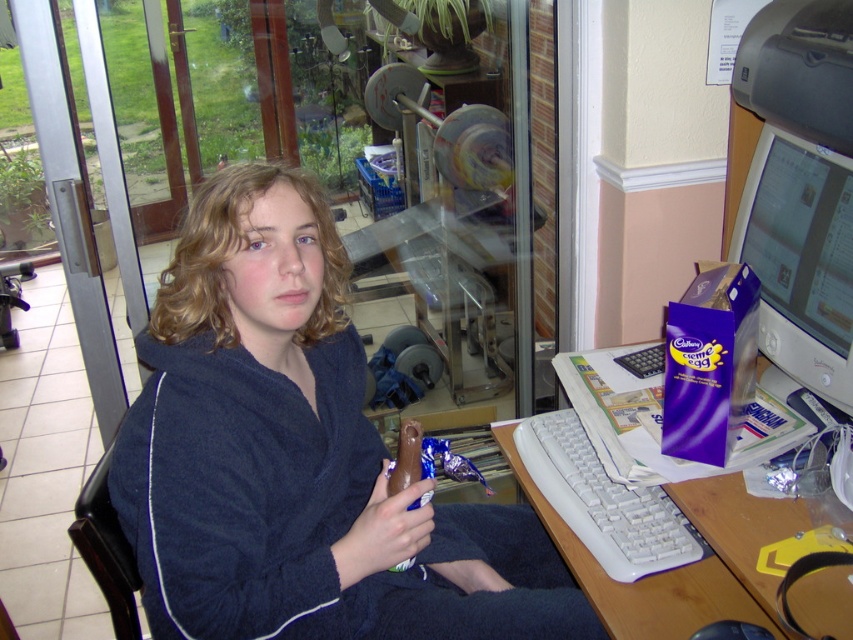
Question: Which point is closer to the camera?

Choices:
 (A) dark blue plush robe at center
 (B) matte plastic computer monitor at right
 (C) white plastic keyboard at right
 (D) transparent glass door at upper center

Answer: (C)

Question: Does dark blue plush robe at center appear under white plastic keyboard at right?

Choices:
 (A) no
 (B) yes

Answer: (A)

Question: Is dark blue plush robe at center bigger than transparent glass door at upper center?

Choices:
 (A) no
 (B) yes

Answer: (A)

Question: Does transparent glass door at upper center appear on the right side of white plastic keyboard at lower center?

Choices:
 (A) yes
 (B) no

Answer: (B)

Question: Which point is closer to the camera?

Choices:
 (A) transparent glass door at upper center
 (B) white plastic keyboard at lower center

Answer: (B)

Question: Which object is closer to the camera taking this photo?

Choices:
 (A) matte plastic computer monitor at right
 (B) dark blue plush robe at center
 (C) white plastic keyboard at right

Answer: (C)